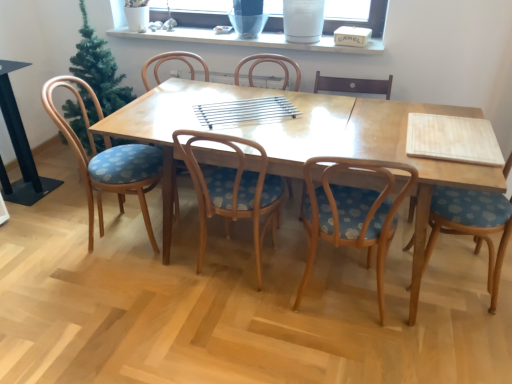
At what (x,y) coordinates should I click in order to perform the action: click on free space below wooden chair with blue floral cushion at left, acting as the sixth chair starting from the right (from a real-world perspective). Please return your answer as a coordinate pair (x, y). This screenshot has height=384, width=512. Looking at the image, I should click on (123, 232).